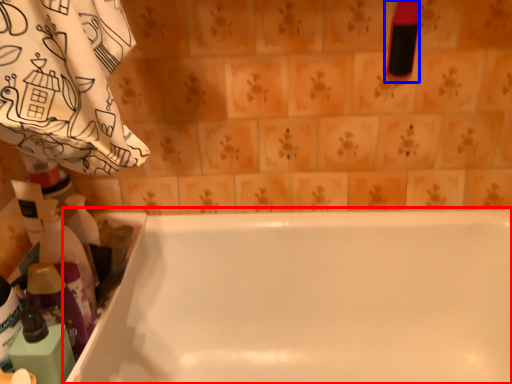
Question: Which of the following is the farthest to the observer, bathtub (highlighted by a red box) or cleaning product (highlighted by a blue box)?

Choices:
 (A) bathtub
 (B) cleaning product

Answer: (B)